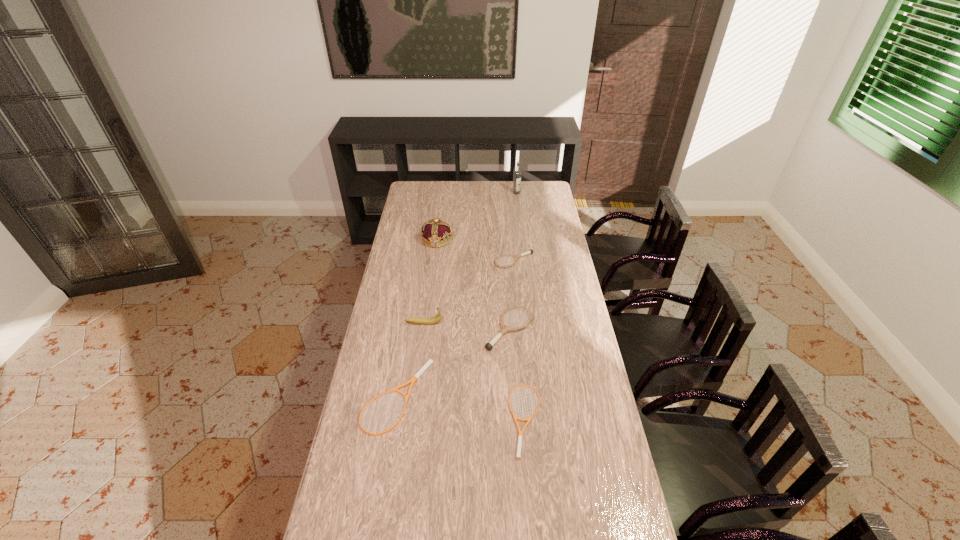
Image resolution: width=960 pixels, height=540 pixels. Find the location of `vodka`. vodka is located at coordinates (517, 174).

You are a GUI agent. You are given a task and a screenshot of the screen. Output one action in this format:
    pyautogui.click(x=<x>, y=<y>)
    Task: Click on the tallest object
    
    Given the screenshot: What is the action you would take?
    click(517, 174)

At what (x,y) coordinates should I click in order to perform the action: click on crown. Please return your answer as a coordinate pair (x, y). Looking at the image, I should click on (436, 233).

I want to click on purple crown, so click(x=436, y=233).

At what (x,y) coordinates should I click in order to perform the action: click on banana. Please return your answer as a coordinate pair (x, y). The width and height of the screenshot is (960, 540). Looking at the image, I should click on (424, 321).

Locate an element on the screen. the fifth shortest object is located at coordinates (424, 321).

Where is `the bigger gray tennis racket`? Image resolution: width=960 pixels, height=540 pixels. the bigger gray tennis racket is located at coordinates (505, 328).

Where is `the fourth tallest object`? the fourth tallest object is located at coordinates (505, 328).

Locate an element on the screen. The height and width of the screenshot is (540, 960). the farther gray tennis racket is located at coordinates (530, 251).

What are the coordinates of `the third shortest tennis racket` in the screenshot? It's located at (530, 251).